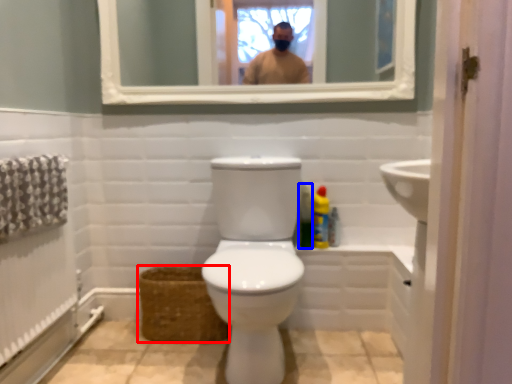
Question: Which object appears closest to the camera in this image, basket (highlighted by a red box) or cleaning product (highlighted by a blue box)?

Choices:
 (A) basket
 (B) cleaning product

Answer: (A)